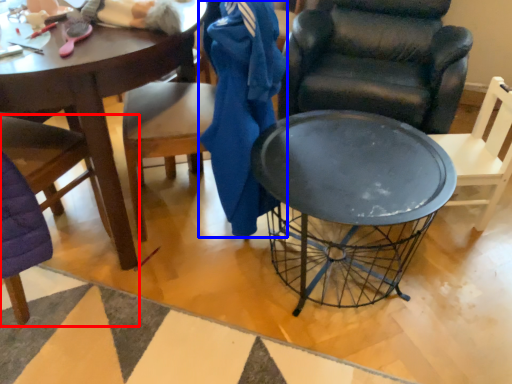
Question: Among these objects, which one is farthest to the camera, chair (highlighted by a red box) or clothing (highlighted by a blue box)?

Choices:
 (A) chair
 (B) clothing

Answer: (B)